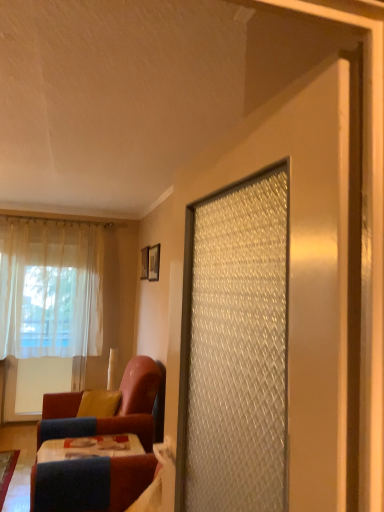
Question: From the image's perspective, is wooden table at lower left located above or below white sheer curtain at left?

Choices:
 (A) above
 (B) below

Answer: (B)

Question: Would you say wooden table at lower left is to the left or to the right of white sheer curtain at left in the picture?

Choices:
 (A) left
 (B) right

Answer: (B)

Question: Estimate the real-world distances between objects in this image. Which object is farther from the wooden table at lower left?

Choices:
 (A) white sheer curtain at left
 (B) yellow fabric pillow at lower left
 (C) wooden picture frame at upper center, positioned as the first picture frame in back-to-front order
 (D) velvet-like red chair at lower left
 (E) matte black picture frame at upper center, the second picture frame viewed from the left

Answer: (A)

Question: Which of these objects is positioned farthest from the velvet-like red chair at lower left?

Choices:
 (A) yellow fabric pillow at lower left
 (B) wooden picture frame at upper center, which is counted as the second picture frame, starting from the right
 (C) white sheer curtain at left
 (D) wooden table at lower left
 (E) matte black picture frame at upper center, placed as the 1th picture frame when sorted from front to back

Answer: (C)